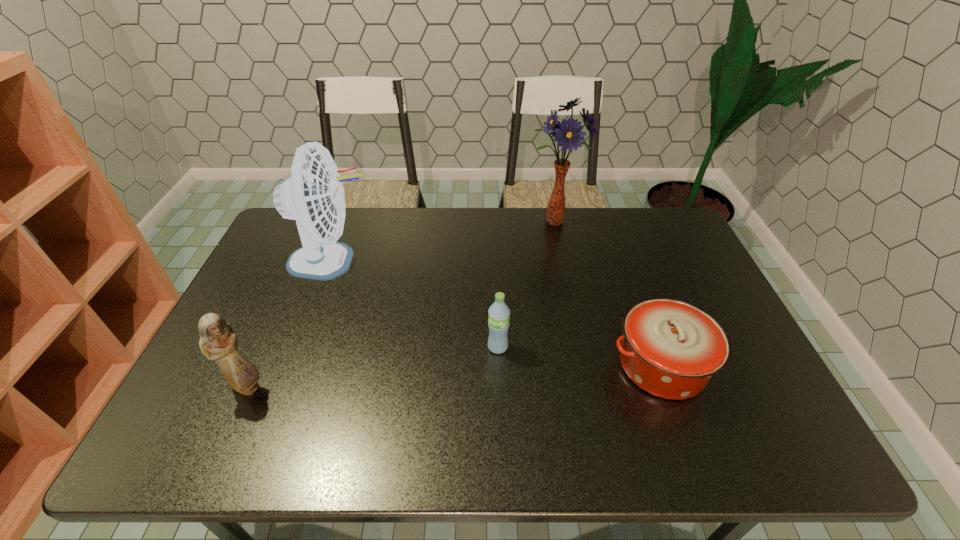
Image resolution: width=960 pixels, height=540 pixels. What are the coordinates of `vacant space positioned on the left of the casserole` in the screenshot? It's located at click(x=486, y=366).

Where is `flower arrangement that is at the far edge`? Image resolution: width=960 pixels, height=540 pixels. flower arrangement that is at the far edge is located at coordinates (568, 134).

Locate an element on the screen. This screenshot has height=540, width=960. fan present at the far edge is located at coordinates (314, 196).

Find the location of `fan present at the left edge`. fan present at the left edge is located at coordinates (314, 196).

The height and width of the screenshot is (540, 960). In order to click on figurine positioned at the left edge in this screenshot , I will do `click(218, 341)`.

This screenshot has height=540, width=960. I want to click on object present at the right edge, so click(671, 348).

Where is `object located in the far left corner section of the desktop`? The width and height of the screenshot is (960, 540). object located in the far left corner section of the desktop is located at coordinates (314, 196).

You are a GUI agent. You are given a task and a screenshot of the screen. Output one action in this format:
    pyautogui.click(x=<x>, y=<y>)
    Task: Click on the free space at the far edge
    This screenshot has width=960, height=540.
    Given the screenshot: What is the action you would take?
    pyautogui.click(x=564, y=234)

Locate an element on the screen. vacant space at the right edge is located at coordinates (745, 389).

Find the location of a particular element. This screenshot has height=540, width=960. free space between the flower arrangement and the fourth nearest object is located at coordinates (444, 242).